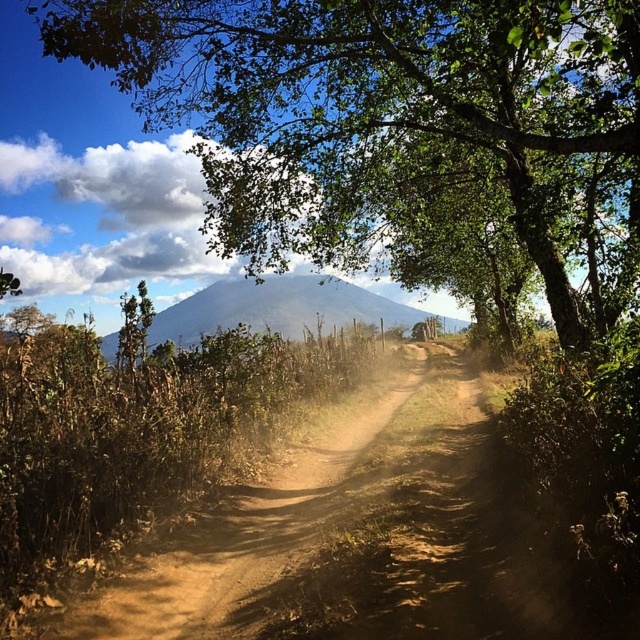
Which is in front, point (333, 3) or point (252, 307)?

Positioned in front is point (333, 3).

Which is behind, point (476, 163) or point (273, 323)?

The point (273, 323) is behind.

You are a GUI agent. You are given a task and a screenshot of the screen. Output one action in this format:
    pyautogui.click(x=<x>, y=<y>)
    Task: Click on the green leafy tree at center
    The height and width of the screenshot is (640, 640).
    Given the screenshot: What is the action you would take?
    pyautogui.click(x=380, y=113)